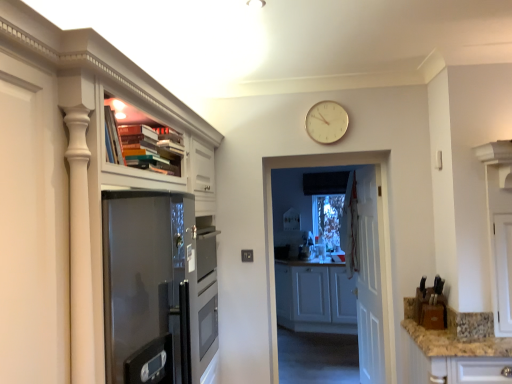
You are a GUI agent. You are given a task and a screenshot of the screen. Output one action in this format:
    pyautogui.click(x=<x>, y=<y>)
    Task: Click on the free space in front of granite countertop at lower right
    Image resolution: width=512 pixels, height=384 pixels.
    Given the screenshot: What is the action you would take?
    pyautogui.click(x=486, y=341)